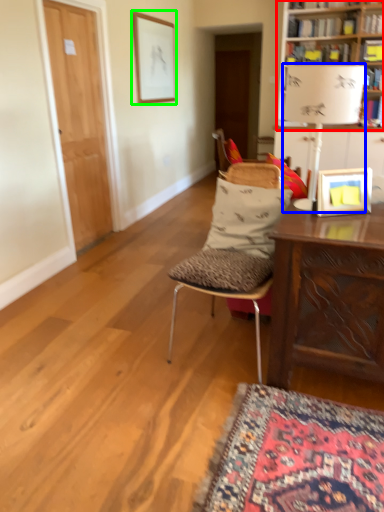
Question: Based on their relative distances, which object is farther from bookcase (highlighted by a red box)? Choose from lamp (highlighted by a blue box) and picture frame (highlighted by a green box).

Choices:
 (A) lamp
 (B) picture frame

Answer: (B)